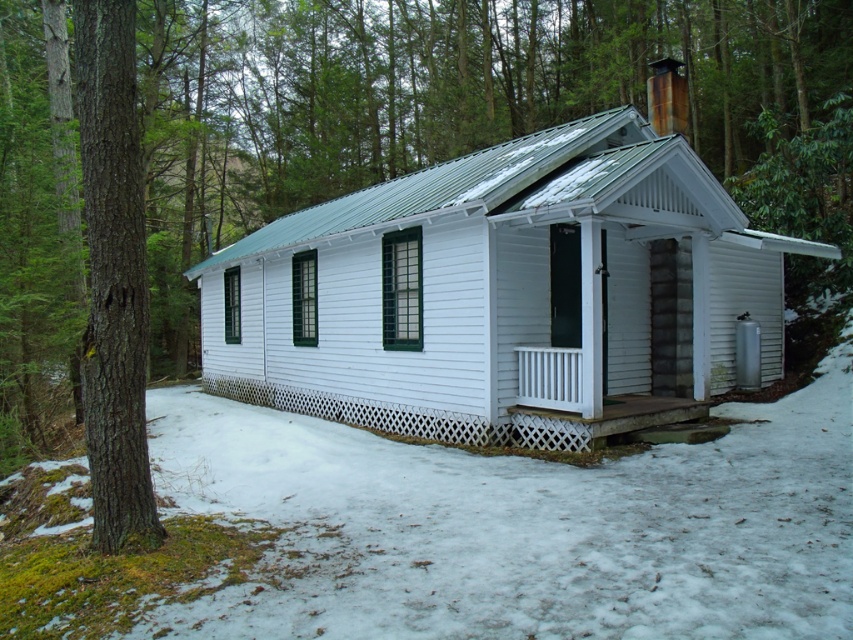
Question: Can you confirm if brown rough bark tree at left is wider than white lattice porch at lower center?

Choices:
 (A) no
 (B) yes

Answer: (A)

Question: Which of the following is the farthest from the observer?

Choices:
 (A) white wooden cabin at center
 (B) white lattice porch at lower center

Answer: (B)

Question: Does white wooden cabin at center have a smaller size compared to white lattice porch at lower center?

Choices:
 (A) yes
 (B) no

Answer: (B)

Question: Can you confirm if white wooden cabin at center is positioned above brown rough bark tree at left?

Choices:
 (A) yes
 (B) no

Answer: (A)

Question: Which point appears closest to the camera in this image?

Choices:
 (A) (537, 419)
 (B) (618, 346)

Answer: (A)

Question: Among these objects, which one is nearest to the camera?

Choices:
 (A) white wooden cabin at center
 (B) brown rough bark tree at left
 (C) white lattice porch at lower center

Answer: (B)